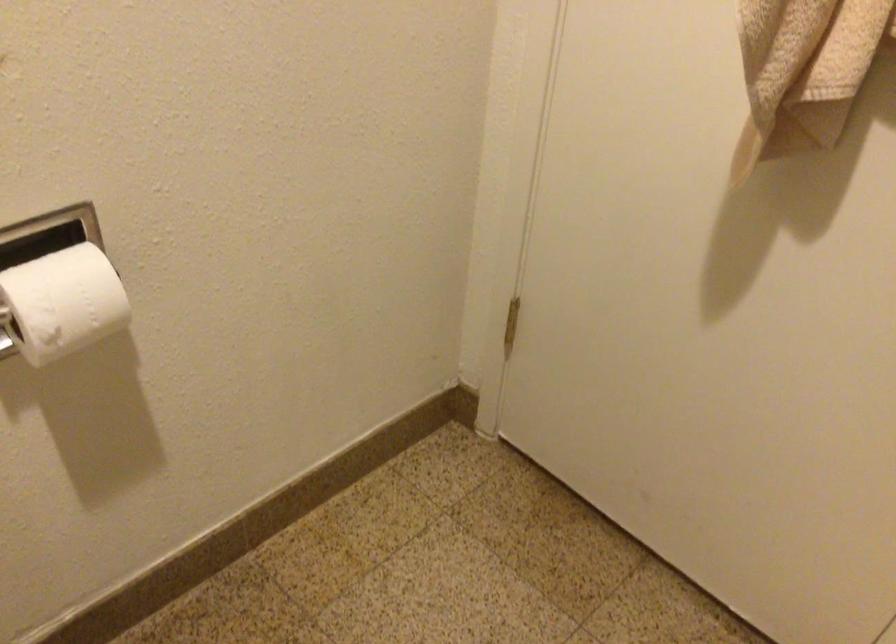
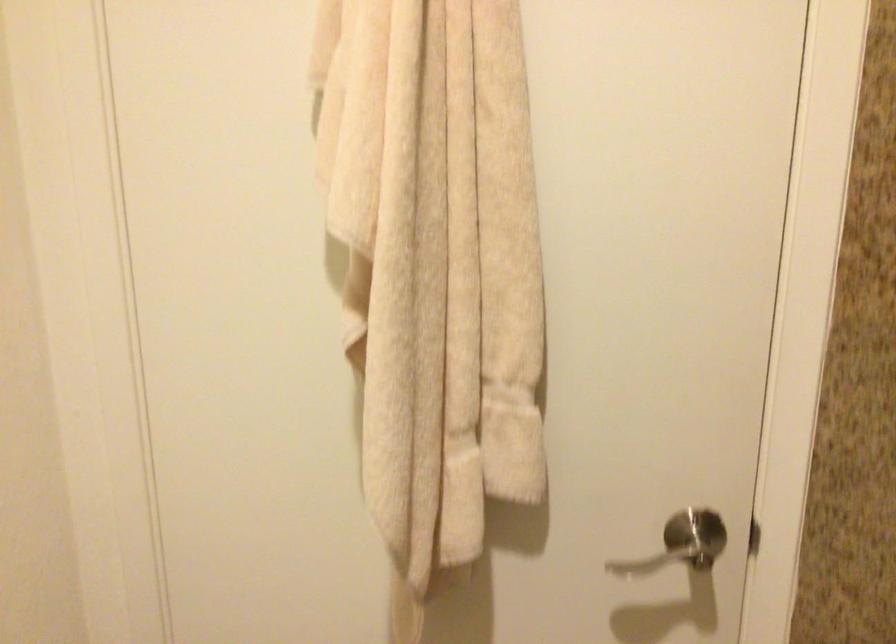
Question: The images are taken continuously from a first-person perspective. In which direction is your viewpoint rotating?

Choices:
 (A) Left
 (B) Right
 (C) Up
 (D) Down

Answer: (B)